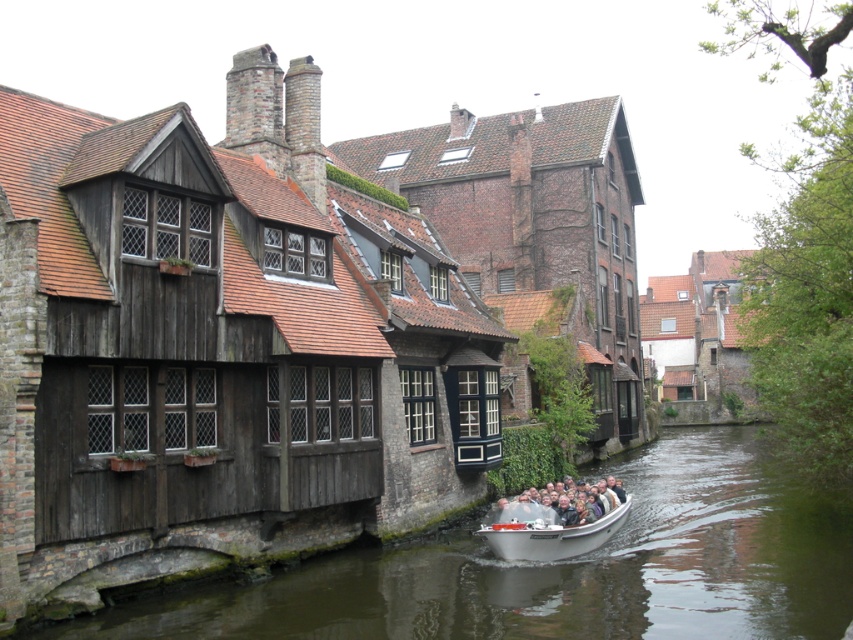
You are standing on the dock next to the canal and want to know if the white plastic boat at center is floating higher than the greenish water at center. Can you determine this based on the scene?

The greenish water at center has a lesser height compared to white plastic boat at center, which means the white plastic boat at center is floating higher than the greenish water at center.

You are standing at the edge of the canal and want to know the exact position of the greenish water at center. According to the coordinates provided, where is it located?

The greenish water at center is located at point (564, 568).

You are standing on the canal bank and see the greenish water at center and the white plastic boat at center. Which object is closer to the ground level?

The greenish water at center is located below the white plastic boat at center, so the greenish water at center is closer to the ground level.